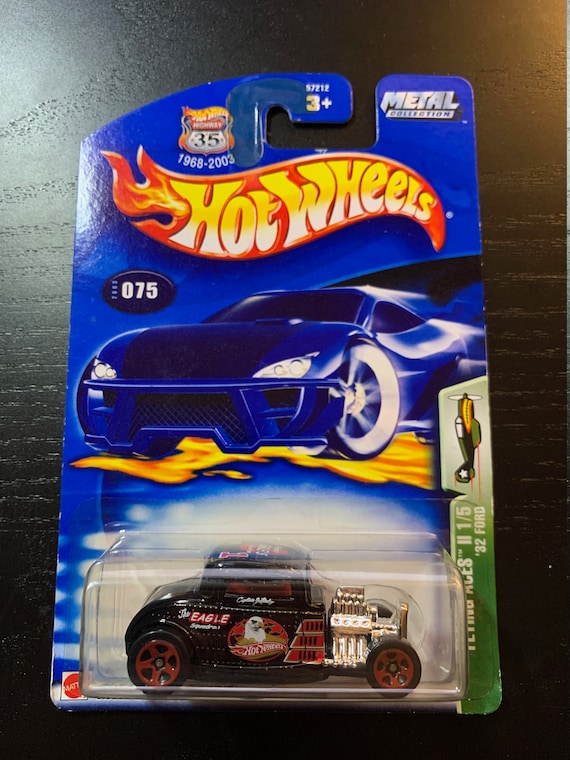
Image resolution: width=570 pixels, height=760 pixels. Identify the location of table. (504, 315).